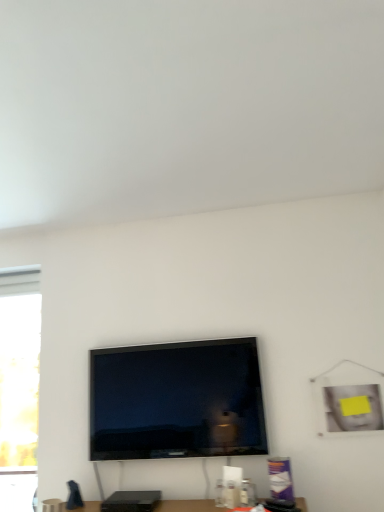
Question: Would you say translucent glass window at left is to the left or to the right of matte black tv at center in the picture?

Choices:
 (A) left
 (B) right

Answer: (A)

Question: From the image's perspective, relative to matte black tv at center, is translucent glass window at left above or below?

Choices:
 (A) above
 (B) below

Answer: (B)

Question: Estimate the real-world distances between objects in this image. Which object is farther from the matte black tv at center?

Choices:
 (A) matte black speaker at lower center
 (B) translucent glass window at left

Answer: (B)

Question: Estimate the real-world distances between objects in this image. Which object is farther from the translucent glass window at left?

Choices:
 (A) matte black tv at center
 (B) matte black speaker at lower center

Answer: (B)